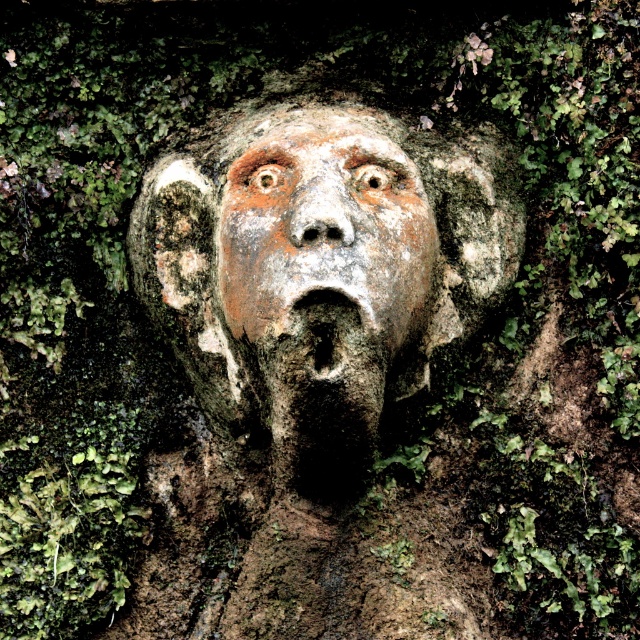
You are an archaeologist examining the stone carvings. You notice two faces carved into the stone wall. Which one is bigger? The weathered stone face at center or the rusty stone face at center?

The weathered stone face at center is larger in size than the rusty stone face at center.

You are an archaeologist examining two stone faces in the image. The weathered stone face at center and the rusty stone face at center. Which one is more to the left?

The weathered stone face at center is positioned on the left side of rusty stone face at center, so it is more to the left.